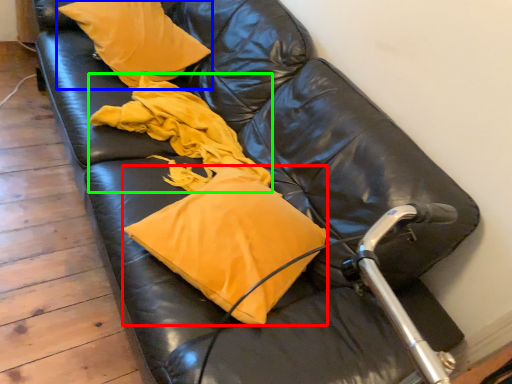
Question: Which is nearer to the pillow (highlighted by a red box)? pillow (highlighted by a blue box) or material (highlighted by a green box).

Choices:
 (A) pillow
 (B) material

Answer: (B)